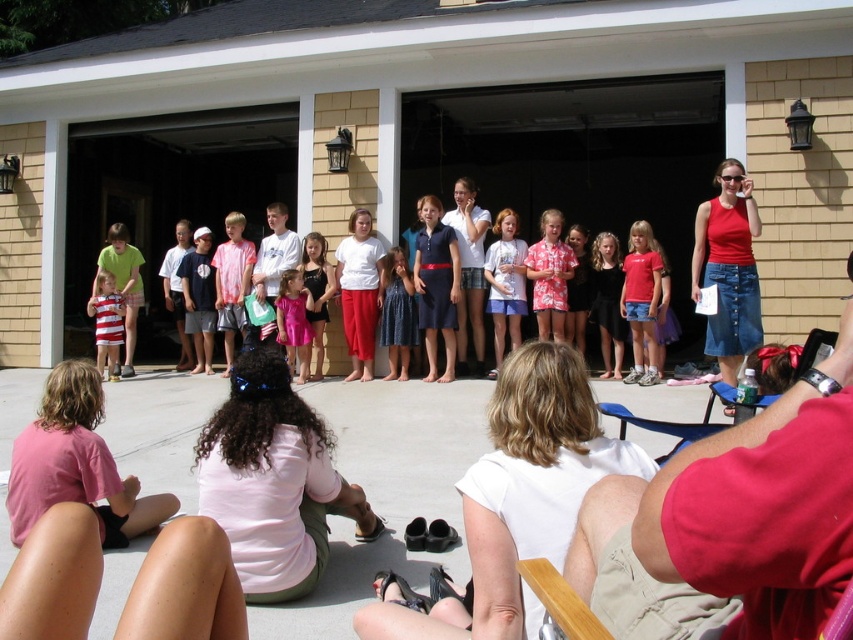
Can you confirm if denim skirt at right is positioned below striped cotton dress at left?

Actually, denim skirt at right is above striped cotton dress at left.

Can you confirm if denim skirt at right is positioned above striped cotton dress at left?

Yes.

Between point (720, 230) and point (122, 320), which one is positioned behind?

The point (122, 320) is more distant.

This screenshot has width=853, height=640. Find the location of `denim skirt at right`. denim skirt at right is located at coordinates (728, 268).

Is pink matte shirt at lower left below pink fabric dress at center?

Correct, pink matte shirt at lower left is located below pink fabric dress at center.

Between point (83, 451) and point (506, 291), which one is positioned in front?

Point (83, 451)

Is point (26, 518) positioned before point (490, 378)?

That is True.

The height and width of the screenshot is (640, 853). Find the location of `pink matte shirt at lower left`. pink matte shirt at lower left is located at coordinates (76, 464).

Looking at this image, does white matte shirt at center have a larger size compared to striped cotton shorts at left?

Correct, white matte shirt at center is larger in size than striped cotton shorts at left.

Who is more distant from viewer, (606, 449) or (142, 289)?

The point (142, 289) is more distant.

The width and height of the screenshot is (853, 640). Identify the location of white matte shirt at center. (515, 499).